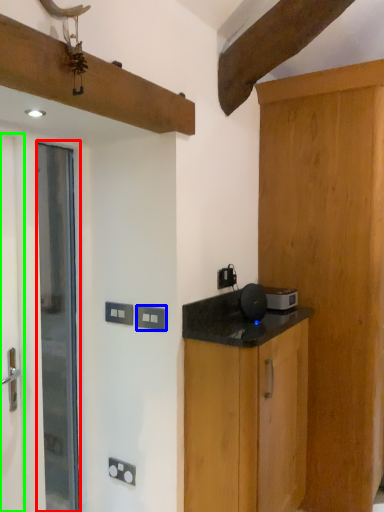
Question: Which object is the closest to the door (highlighted by a red box)? Choose among these: electric outlet (highlighted by a blue box) or screen door (highlighted by a green box).

Choices:
 (A) electric outlet
 (B) screen door

Answer: (B)